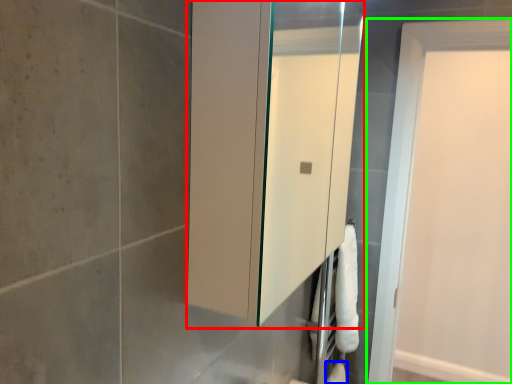
Question: Which object is positioned farthest from medicine cabinet (highlighted by a red box)? Select from toilet paper (highlighted by a blue box) and door (highlighted by a green box).

Choices:
 (A) toilet paper
 (B) door

Answer: (A)